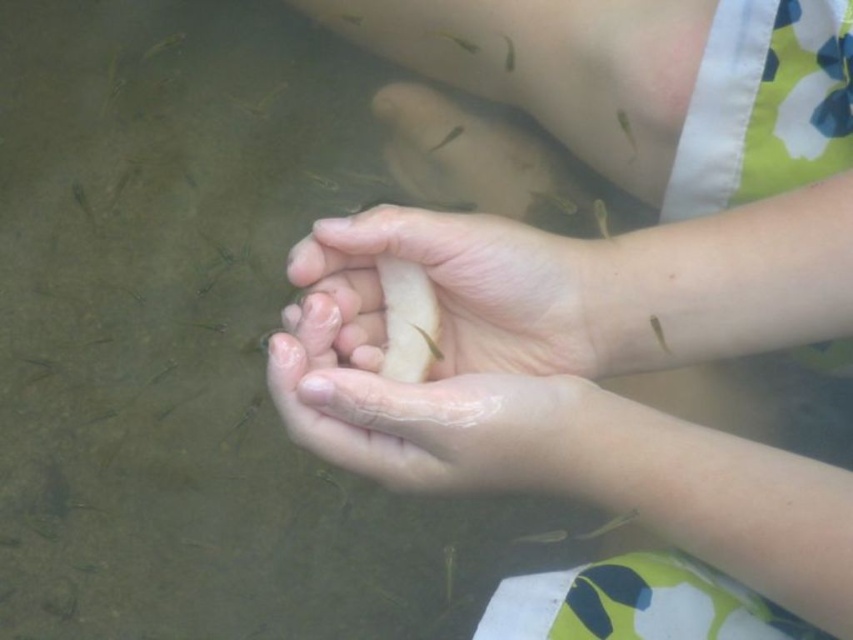
Question: Which object appears farthest from the camera in this image?

Choices:
 (A) smooth skin hands at center
 (B) smooth skin hand at center
 (C) translucent skin at center

Answer: (B)

Question: Is smooth skin hands at center positioned behind translucent skin at center?

Choices:
 (A) yes
 (B) no

Answer: (B)

Question: Which object is closer to the camera taking this photo?

Choices:
 (A) translucent skin at center
 (B) smooth skin hand at center
 (C) smooth skin hands at center

Answer: (C)

Question: From the image, what is the correct spatial relationship of smooth skin hands at center in relation to translucent skin at center?

Choices:
 (A) below
 (B) above

Answer: (B)

Question: Does translucent skin at center appear under smooth skin hand at center?

Choices:
 (A) no
 (B) yes

Answer: (B)

Question: Which of the following is the farthest from the observer?

Choices:
 (A) smooth skin hands at center
 (B) translucent skin at center
 (C) smooth skin hand at center

Answer: (C)